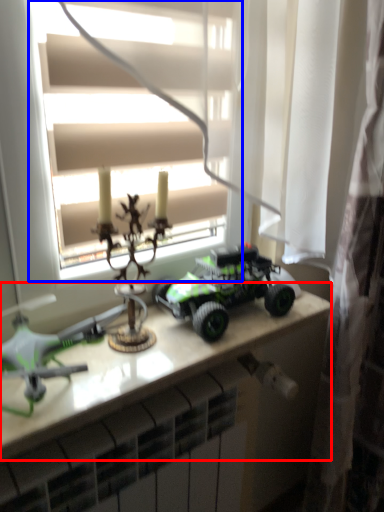
Question: Which of the following is the farthest to the observer, table (highlighted by a red box) or window (highlighted by a blue box)?

Choices:
 (A) table
 (B) window

Answer: (A)